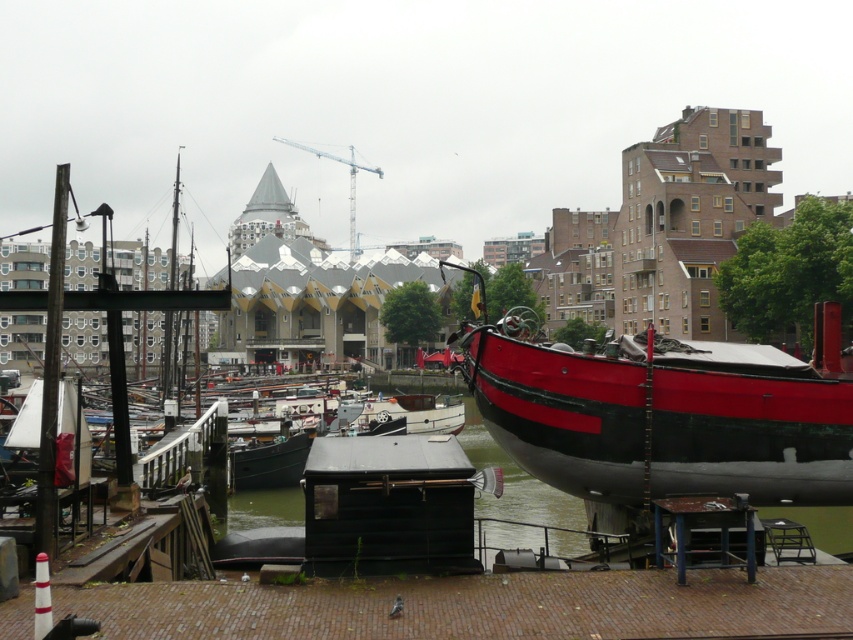
Question: Considering the real-world distances, which object is closest to the matte black boat at center?

Choices:
 (A) red polished wood boat at right
 (B) white glossy boat at center

Answer: (B)

Question: Is red polished wood boat at right wider than matte black boat at center?

Choices:
 (A) yes
 (B) no

Answer: (A)

Question: In this image, where is red polished wood boat at right located relative to matte black boat at center?

Choices:
 (A) right
 (B) left

Answer: (A)

Question: Among these points, which one is nearest to the camera?

Choices:
 (A) (460, 416)
 (B) (300, 472)

Answer: (B)

Question: Which point appears closest to the camera in this image?

Choices:
 (A) (291, 458)
 (B) (415, 417)
 (C) (531, 445)

Answer: (C)

Question: Is red polished wood boat at right closer to the viewer compared to matte black boat at center?

Choices:
 (A) no
 (B) yes

Answer: (B)